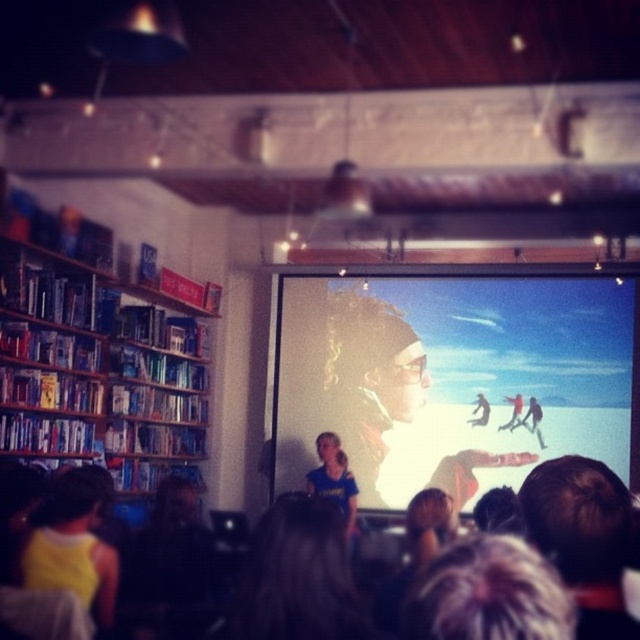
Does wooden bookshelf at left appear under black fabric at lower left?

Incorrect, wooden bookshelf at left is not positioned below black fabric at lower left.

Does wooden bookshelf at left come in front of black fabric at lower left?

No, wooden bookshelf at left is behind black fabric at lower left.

Who is more distant from viewer, (124, 468) or (188, 524)?

The point (124, 468) is more distant.

Where is `wooden bookshelf at left`? Image resolution: width=640 pixels, height=640 pixels. wooden bookshelf at left is located at coordinates (96, 372).

Does dark brown hair at lower center have a greater height compared to black fabric at lower left?

Indeed, dark brown hair at lower center has a greater height compared to black fabric at lower left.

Does dark brown hair at lower center appear over black fabric at lower left?

Yes, dark brown hair at lower center is above black fabric at lower left.

Between point (417, 595) and point (179, 620), which one is positioned behind?

Point (179, 620)

This screenshot has width=640, height=640. Find the location of `dark brown hair at lower center`. dark brown hair at lower center is located at coordinates (486, 593).

Does fuzzy brown hair at lower right come behind yellow fabric at lower left?

No, it is in front of yellow fabric at lower left.

Based on the photo, is fuzzy brown hair at lower right shorter than yellow fabric at lower left?

Indeed, fuzzy brown hair at lower right has a lesser height compared to yellow fabric at lower left.

Does point (538, 524) lie behind point (81, 506)?

No, (538, 524) is closer to viewer.

You are a GUI agent. You are given a task and a screenshot of the screen. Output one action in this format:
    pyautogui.click(x=<x>, y=<y>)
    Task: Click on the fuzzy brown hair at lower right
    This screenshot has height=640, width=640.
    Given the screenshot: What is the action you would take?
    pyautogui.click(x=582, y=538)